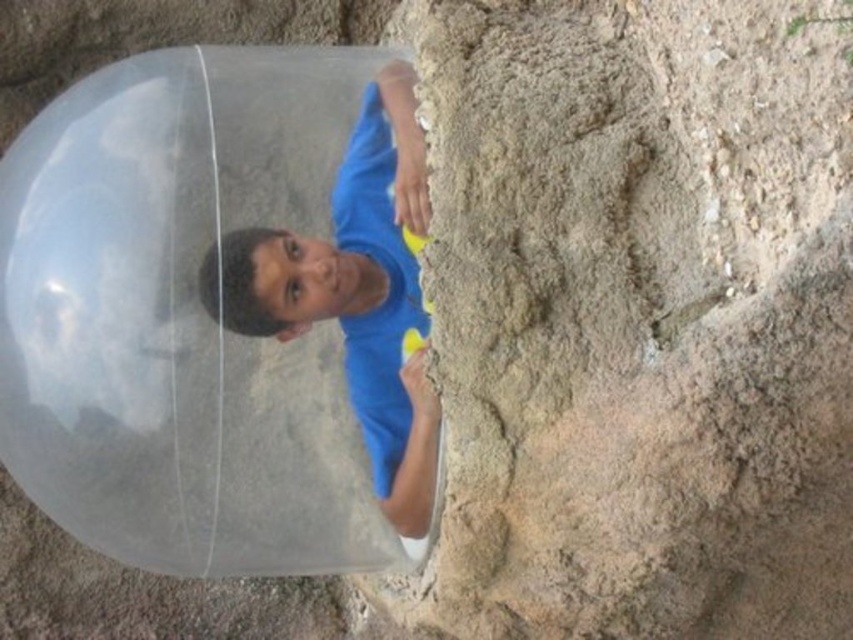
Does transparent plastic bubble at center have a lesser height compared to blue matte shirt at center?

No, transparent plastic bubble at center is not shorter than blue matte shirt at center.

Locate an element on the screen. The image size is (853, 640). transparent plastic bubble at center is located at coordinates (180, 316).